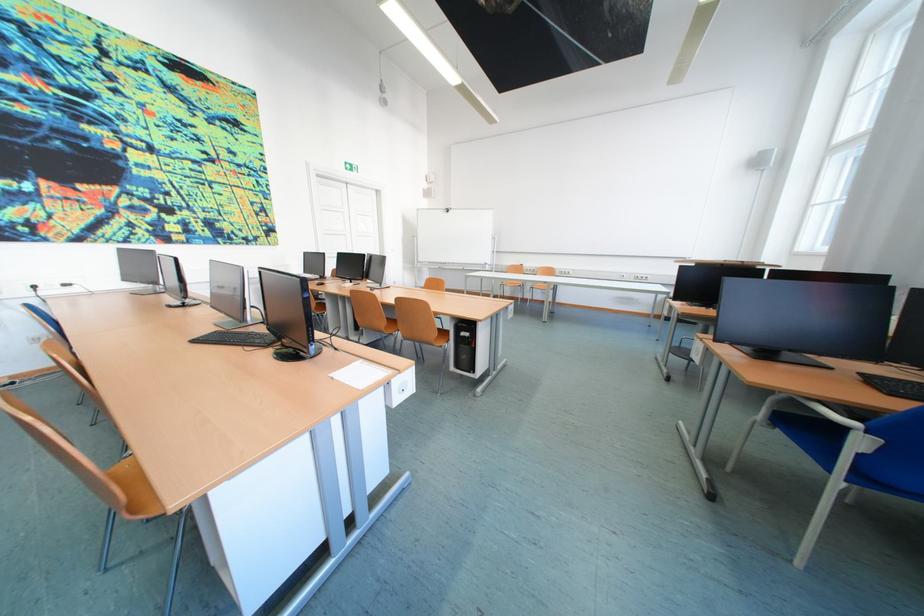
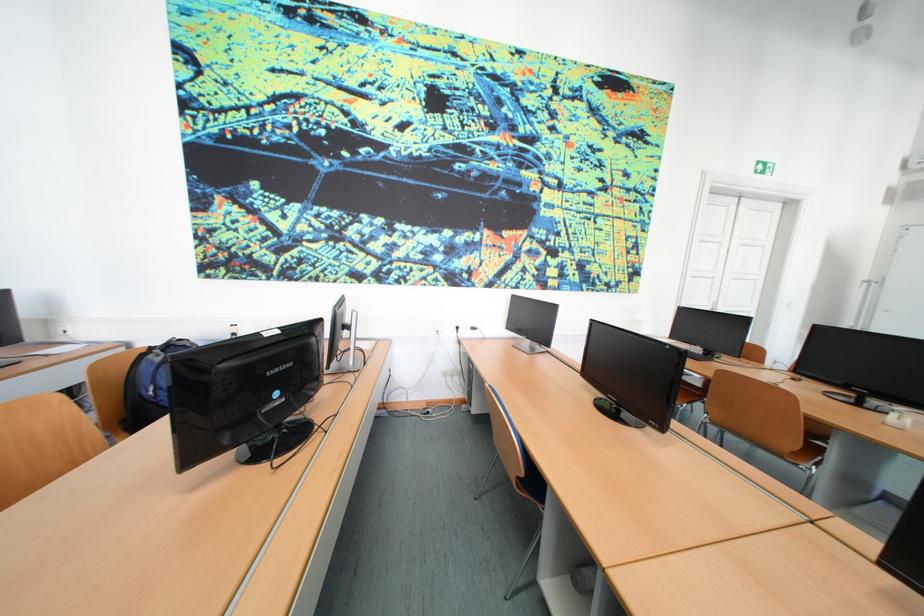
The point at [47,289] is marked in the first image. Where is the corresponding point in the second image?

(470, 330)